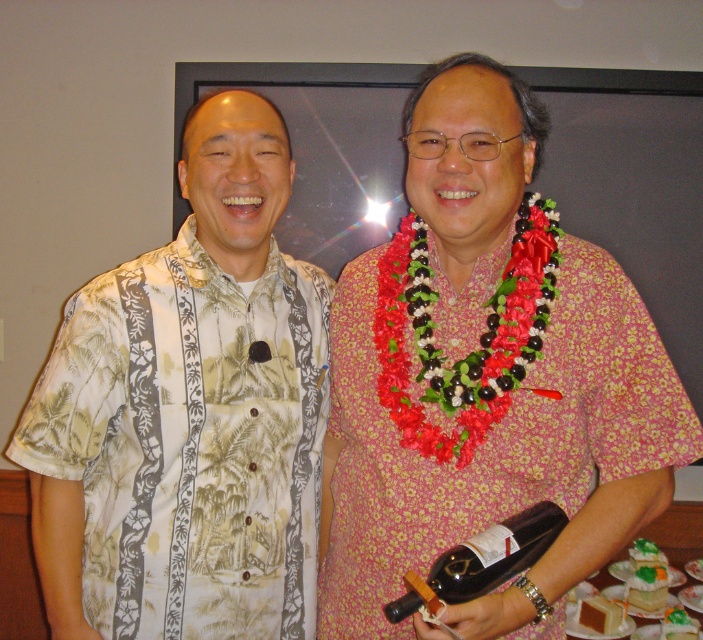
Based on the scene description, where is the white floral shirt at left located in relation to the point marked at coordinates [188,413]?

The point at coordinates [188,413] marks the location of the white floral shirt at left.

You are a photographer at a party and need to capture a photo of the white floral shirt at left and the black glass bottle at lower center. The camera has a minimum focus distance of 18 inches. Will you be able to focus on both objects without moving the camera?

The white floral shirt at left and black glass bottle at lower center are 17.61 inches apart. Since the distance between them is less than the camera minimum focus distance of 18 inches, the camera cannot focus on both objects simultaneously without moving the camera.

You are a photographer at a party and want to take a group photo of the two people. The minimum distance required between subjects for your camera to focus properly is 1.2 meters. Can you take the photo with the current spacing between the white floral shirt at left and the other person?

The two people are 1.19 meters apart, which is less than the required 1.2 meters for proper focus. Therefore, you cannot take the photo with the current spacing between the white floral shirt at left and the other person.